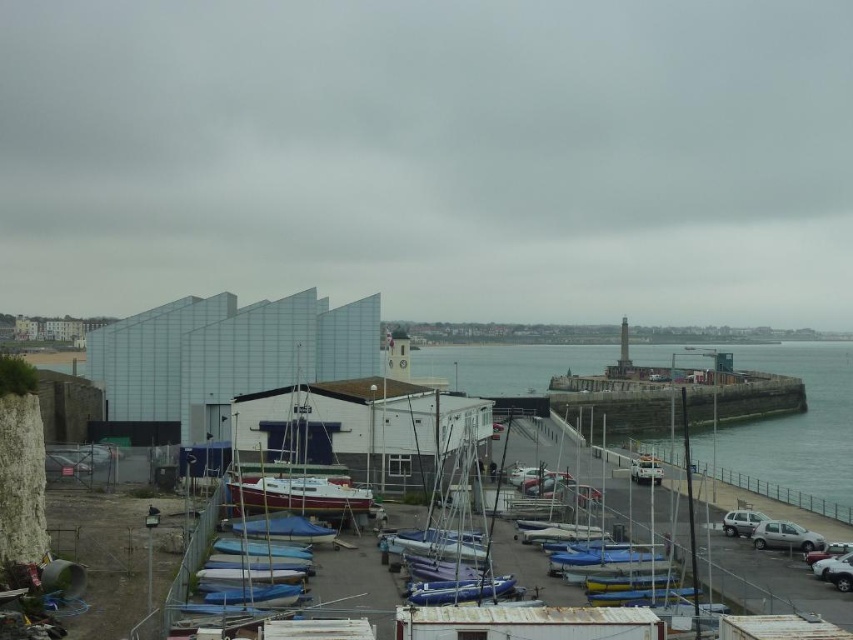
Does white matte sailboat at center have a greater width compared to silver metallic car at lower right?

Yes, white matte sailboat at center is wider than silver metallic car at lower right.

You are a GUI agent. You are given a task and a screenshot of the screen. Output one action in this format:
    pyautogui.click(x=<x>, y=<y>)
    Task: Click on the white matte sailboat at center
    
    Given the screenshot: What is the action you would take?
    pyautogui.click(x=292, y=452)

Is the position of white matte sailboat at center more distant than that of white matte van at center?

Answer: No, it is in front of white matte van at center.

Between white matte sailboat at center and white matte van at center, which one is positioned lower?

Positioned lower is white matte van at center.

At what (x,y) coordinates should I click in order to perform the action: click on white matte sailboat at center. Please return your answer as a coordinate pair (x, y). Looking at the image, I should click on (292, 452).

Find the location of `white matte sailboat at center`. white matte sailboat at center is located at coordinates (292, 452).

Describe the element at coordinates (791, 432) in the screenshot. I see `clear blue water at center` at that location.

Can you confirm if clear blue water at center is positioned below satin silver suv at lower right?

No, clear blue water at center is not below satin silver suv at lower right.

Who is more forward, (x=517, y=388) or (x=740, y=536)?

Point (x=740, y=536)

The height and width of the screenshot is (640, 853). Identify the location of clear blue water at center. pyautogui.click(x=791, y=432).